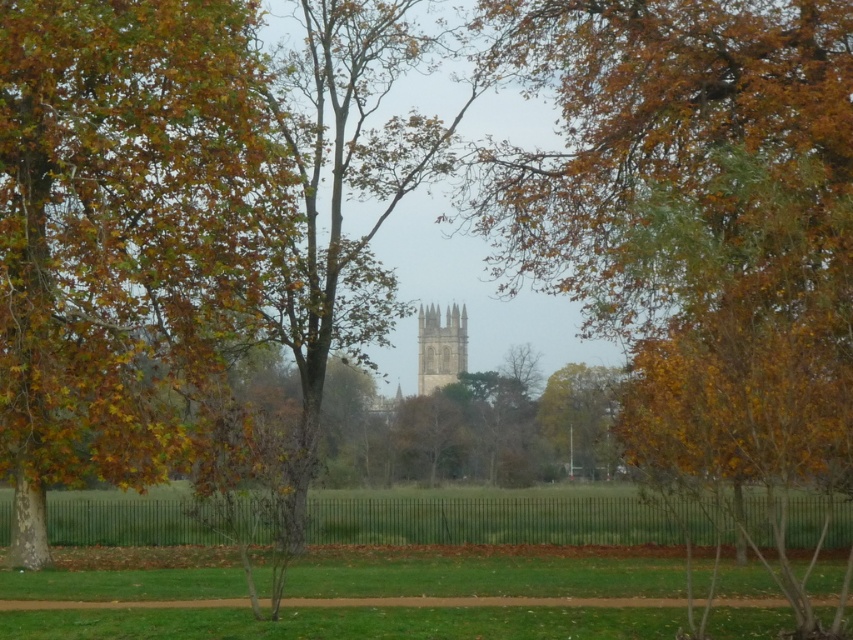
Question: Which of these objects is positioned farthest from the brown leafy tree at center?

Choices:
 (A) gray stone bell tower at center
 (B) autumn leaves at center
 (C) autumn leaves at left

Answer: (C)

Question: Does autumn leaves at center have a smaller size compared to brown leafy tree at center?

Choices:
 (A) no
 (B) yes

Answer: (A)

Question: Can you confirm if autumn leaves at center is bigger than brown leafy tree at center?

Choices:
 (A) no
 (B) yes

Answer: (B)

Question: Estimate the real-world distances between objects in this image. Which object is closer to the gray stone bell tower at center?

Choices:
 (A) autumn leaves at left
 (B) brown leafy tree at center

Answer: (B)

Question: Is autumn leaves at center bigger than autumn leaves at left?

Choices:
 (A) yes
 (B) no

Answer: (A)

Question: Which object is closer to the camera taking this photo?

Choices:
 (A) autumn leaves at center
 (B) brown leafy tree at center
 (C) autumn leaves at left
 (D) gray stone bell tower at center

Answer: (A)